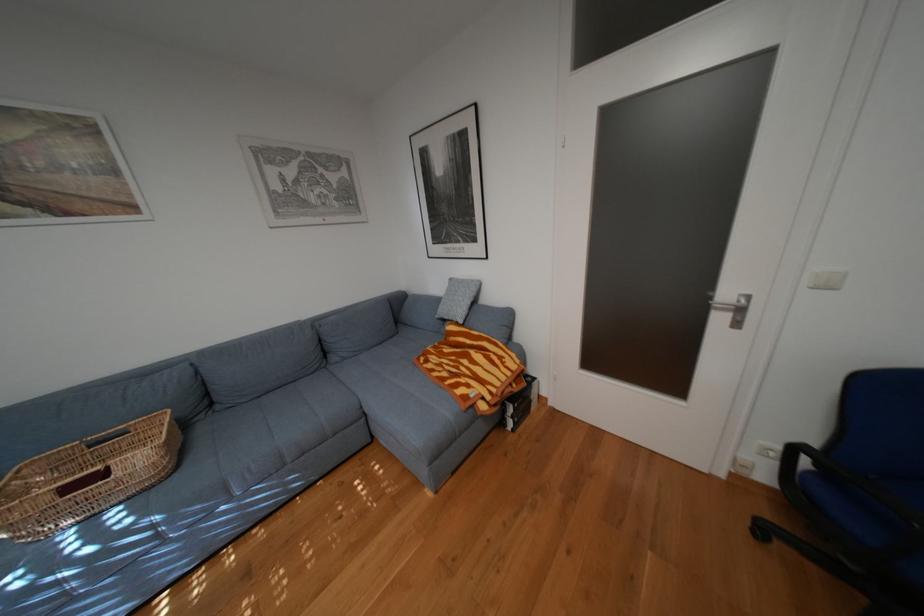
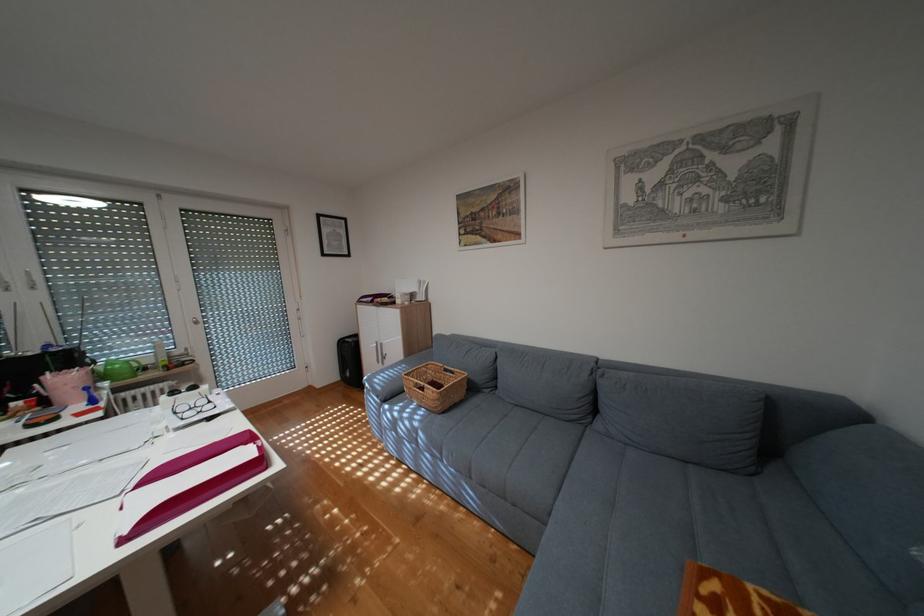
Question: The camera is either moving clockwise (left) or counter-clockwise (right) around the object. The first image is from the beginning of the video and the second image is from the end. Is the camera moving left or right when shooting the video?

Choices:
 (A) Left
 (B) Right

Answer: (B)